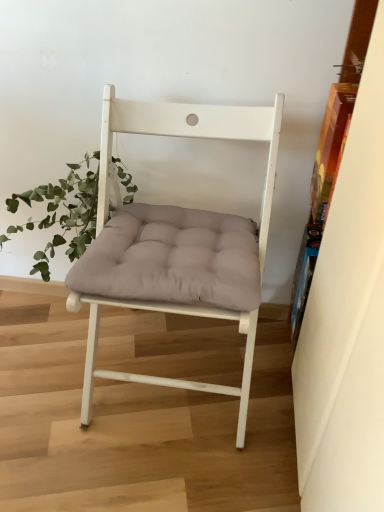
Question: From a real-world perspective, is matte white chair at center beneath wooden bookshelf at right?

Choices:
 (A) yes
 (B) no

Answer: (A)

Question: Is matte white chair at center completely or partially outside of wooden bookshelf at right?

Choices:
 (A) yes
 (B) no

Answer: (A)

Question: Is matte white chair at center looking in the opposite direction of wooden bookshelf at right?

Choices:
 (A) no
 (B) yes

Answer: (A)

Question: Considering the relative sizes of matte white chair at center and wooden bookshelf at right in the image provided, is matte white chair at center taller than wooden bookshelf at right?

Choices:
 (A) no
 (B) yes

Answer: (A)

Question: Is matte white chair at center thinner than wooden bookshelf at right?

Choices:
 (A) no
 (B) yes

Answer: (A)

Question: Considering the positions of point (317, 406) and point (84, 193), is point (317, 406) closer or farther from the camera than point (84, 193)?

Choices:
 (A) closer
 (B) farther

Answer: (A)

Question: In terms of height, does wooden bookshelf at right look taller or shorter compared to green leafy plant at left?

Choices:
 (A) tall
 (B) short

Answer: (A)

Question: In the image, is wooden bookshelf at right on the left side or the right side of green leafy plant at left?

Choices:
 (A) right
 (B) left

Answer: (A)

Question: Considering the positions of wooden bookshelf at right and green leafy plant at left in the image, is wooden bookshelf at right bigger or smaller than green leafy plant at left?

Choices:
 (A) small
 (B) big

Answer: (B)

Question: Based on their sizes in the image, would you say green leafy plant at left is bigger or smaller than wooden bookshelf at right?

Choices:
 (A) big
 (B) small

Answer: (B)

Question: Choose the correct answer: Is green leafy plant at left inside wooden bookshelf at right or outside it?

Choices:
 (A) inside
 (B) outside

Answer: (B)

Question: Relative to wooden bookshelf at right, is green leafy plant at left in front or behind?

Choices:
 (A) behind
 (B) front

Answer: (A)

Question: Looking at their shapes, would you say green leafy plant at left is wider or thinner than wooden bookshelf at right?

Choices:
 (A) thin
 (B) wide

Answer: (B)

Question: Is matte white chair at center wider or thinner than wooden bookshelf at right?

Choices:
 (A) thin
 (B) wide

Answer: (B)

Question: Visually, is matte white chair at center positioned to the left or to the right of wooden bookshelf at right?

Choices:
 (A) left
 (B) right

Answer: (A)